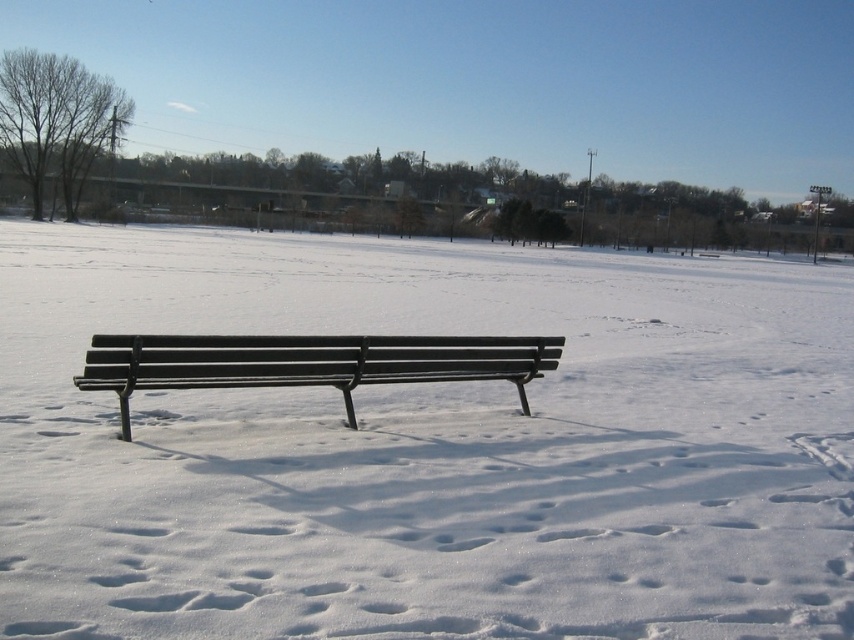
You are designing a winter scene and want to place a bench that is wider than the other. Which bench should you choose between the white matte bench at center and the matte black bench at center?

The white matte bench at center has a larger width than the matte black bench at center, so you should choose the white matte bench at center for a wider bench.

You are standing in the winter scene and see both the white matte bench at center and the matte black bench at center. Which bench is higher up in the image?

The white matte bench at center is above the matte black bench at center in the image.